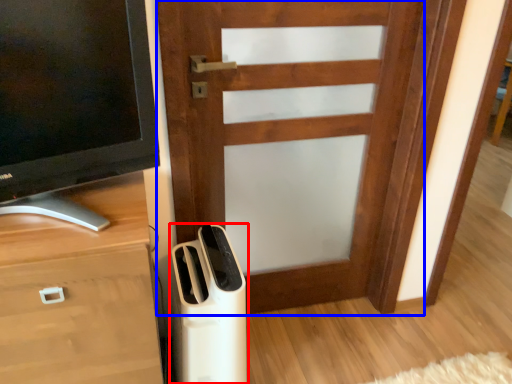
Question: Which object is closer to the camera taking this photo, home appliance (highlighted by a red box) or door (highlighted by a blue box)?

Choices:
 (A) home appliance
 (B) door

Answer: (A)